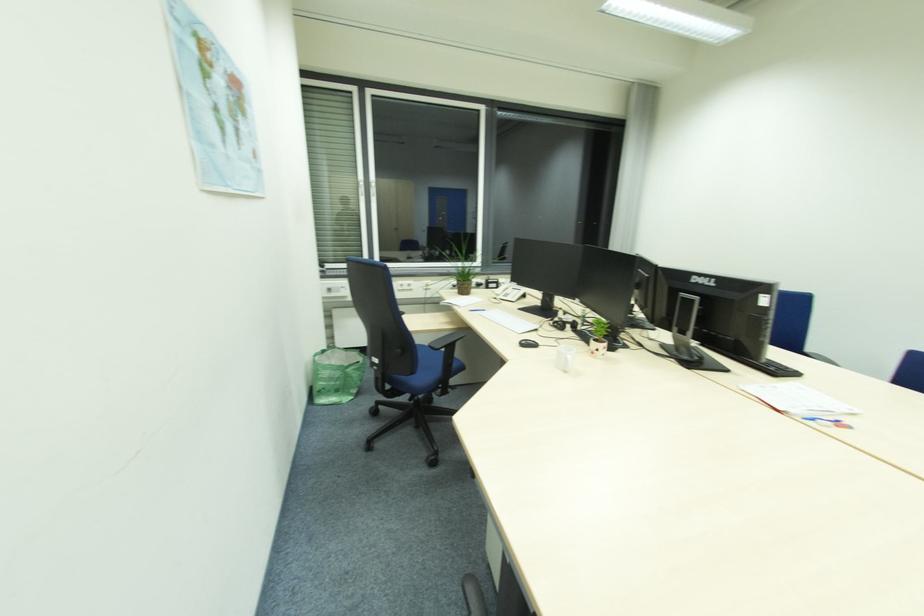
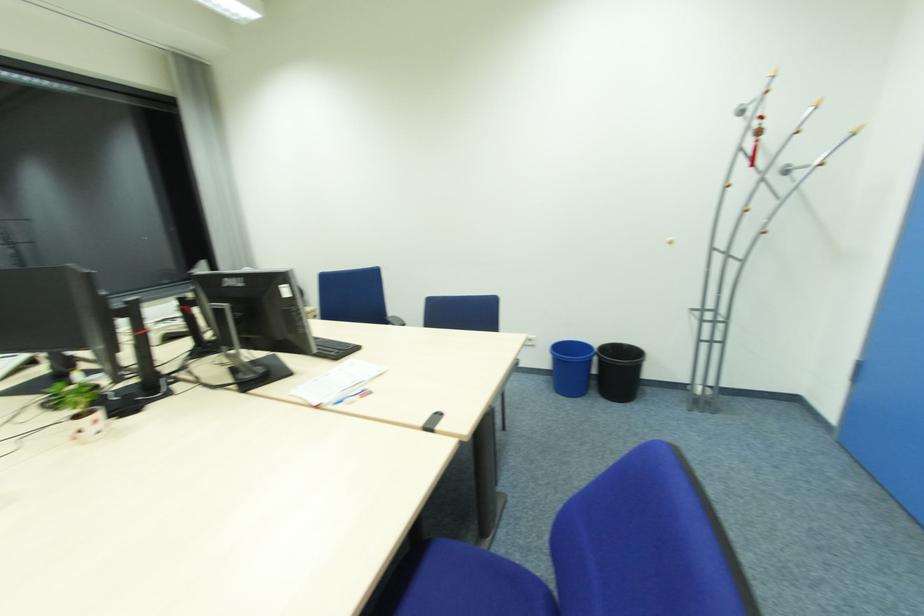
Question: Based on the continuous images, in which direction is the camera rotating? Reply with the corresponding letter.

Choices:
 (A) Left
 (B) Right
 (C) Up
 (D) Down

Answer: (B)